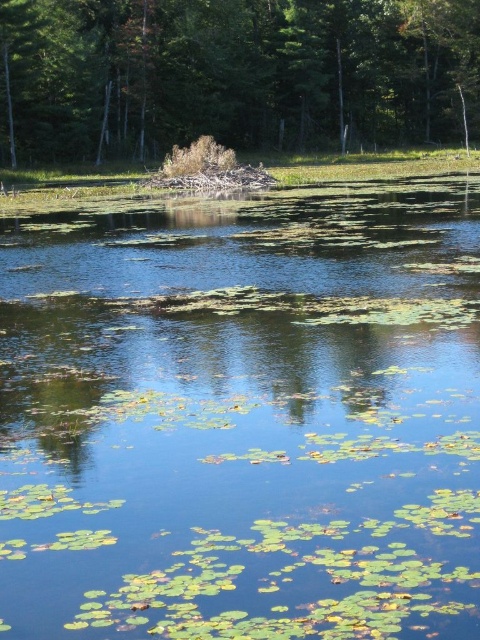
Question: Does green leafy water at center lie behind brown dry leaves at upper center?

Choices:
 (A) no
 (B) yes

Answer: (A)

Question: In this image, where is green leafy water at center located relative to brown dry leaves at upper center?

Choices:
 (A) below
 (B) above

Answer: (A)

Question: Which of the following is the farthest from the observer?

Choices:
 (A) brown dry leaves at upper center
 (B) green leafy water at center

Answer: (A)

Question: Which point is closer to the camera?

Choices:
 (A) (414, 115)
 (B) (271, 541)

Answer: (B)

Question: Is green leafy water at center bigger than brown dry leaves at upper center?

Choices:
 (A) no
 (B) yes

Answer: (A)

Question: Which of the following is the farthest from the observer?

Choices:
 (A) (371, 92)
 (B) (331, 440)

Answer: (A)